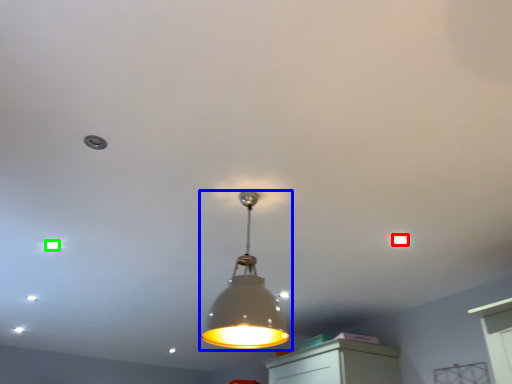
Question: Which is nearer to the dot (highlighted by a red box)? lamp (highlighted by a blue box) or dot (highlighted by a green box).

Choices:
 (A) lamp
 (B) dot

Answer: (A)